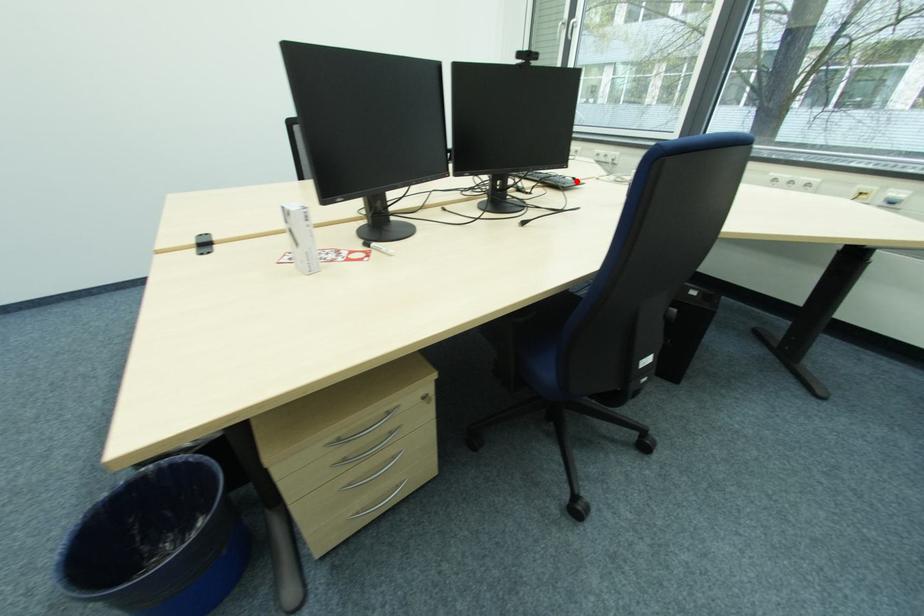
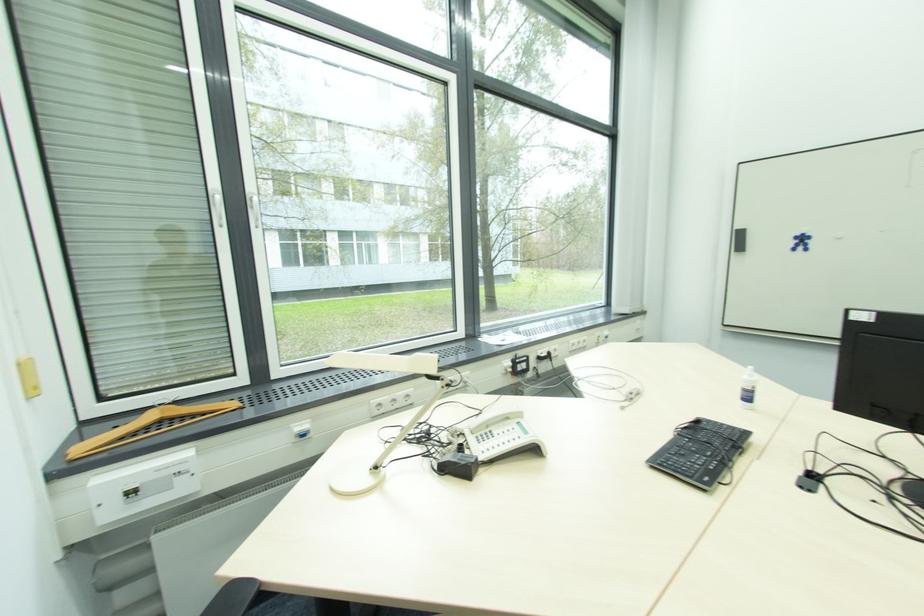
In the second image, find the point that corresponds to the highlighted location in the first image.

(700, 424)